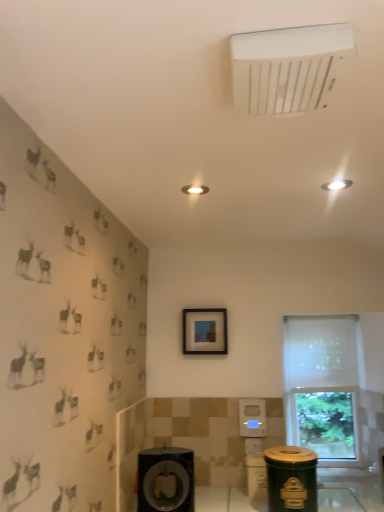
Question: Is white sheer curtain at right oriented away from white plastic air conditioning unit at upper center?

Choices:
 (A) yes
 (B) no

Answer: (B)

Question: Considering the relative sizes of white sheer curtain at right and white plastic air conditioning unit at upper center in the image provided, is white sheer curtain at right shorter than white plastic air conditioning unit at upper center?

Choices:
 (A) yes
 (B) no

Answer: (B)

Question: Can you confirm if white sheer curtain at right is positioned to the right of white plastic air conditioning unit at upper center?

Choices:
 (A) no
 (B) yes

Answer: (B)

Question: Can you see white sheer curtain at right touching white plastic air conditioning unit at upper center?

Choices:
 (A) no
 (B) yes

Answer: (A)

Question: Considering the relative sizes of white sheer curtain at right and white plastic air conditioning unit at upper center in the image provided, is white sheer curtain at right wider than white plastic air conditioning unit at upper center?

Choices:
 (A) yes
 (B) no

Answer: (B)

Question: Do you think white frosted glass window at right is within white sheer curtain at right, or outside of it?

Choices:
 (A) inside
 (B) outside

Answer: (A)

Question: Based on their positions, is white frosted glass window at right located to the left or right of white sheer curtain at right?

Choices:
 (A) left
 (B) right

Answer: (B)

Question: From a real-world perspective, is white frosted glass window at right above or below white sheer curtain at right?

Choices:
 (A) below
 (B) above

Answer: (A)

Question: Looking at their shapes, would you say white frosted glass window at right is wider or thinner than white sheer curtain at right?

Choices:
 (A) thin
 (B) wide

Answer: (A)

Question: From their relative heights in the image, would you say white frosted glass window at right is taller or shorter than green matte trash can at lower right?

Choices:
 (A) short
 (B) tall

Answer: (B)

Question: From a real-world perspective, is white frosted glass window at right physically located above or below green matte trash can at lower right?

Choices:
 (A) above
 (B) below

Answer: (A)

Question: Relative to green matte trash can at lower right, is white frosted glass window at right in front or behind?

Choices:
 (A) front
 (B) behind

Answer: (B)

Question: In terms of size, does white frosted glass window at right appear bigger or smaller than green matte trash can at lower right?

Choices:
 (A) small
 (B) big

Answer: (B)

Question: Does point (221, 337) appear closer or farther from the camera than point (236, 48)?

Choices:
 (A) closer
 (B) farther

Answer: (B)

Question: Based on their sizes in the image, would you say matte black picture frame at center is bigger or smaller than white plastic air conditioning unit at upper center?

Choices:
 (A) big
 (B) small

Answer: (A)